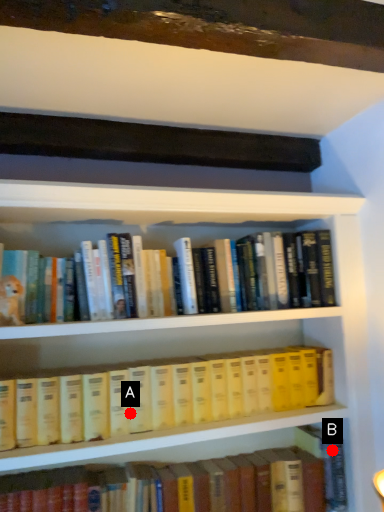
Question: Two points are circled on the image, labeled by A and B beside each circle. Which point appears closest to the camera in this image?

Choices:
 (A) A is closer
 (B) B is closer

Answer: (A)